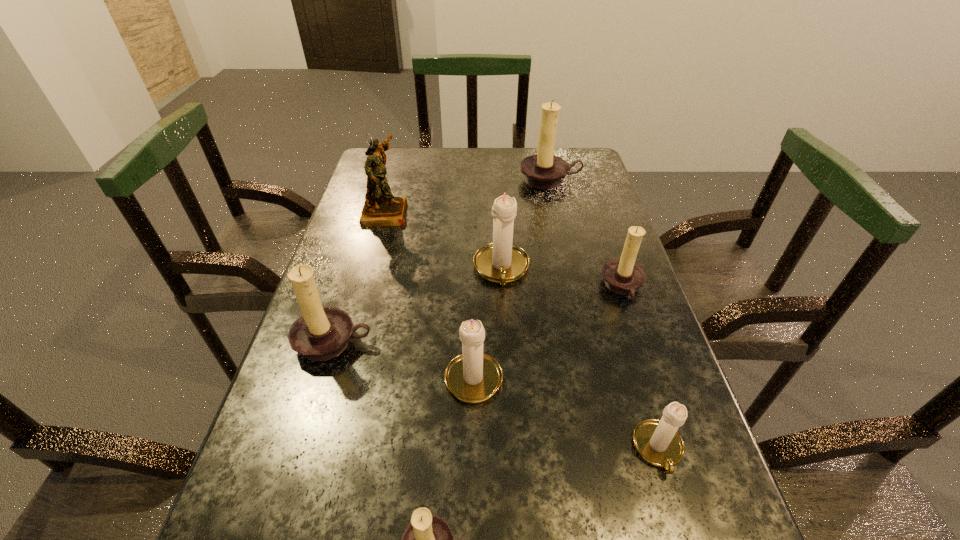
Image resolution: width=960 pixels, height=540 pixels. In order to click on the seventh farthest object in this screenshot , I will do `click(658, 442)`.

What are the coordinates of `vacant space situated 0.260m on the wick of the biggest brown candle holder` in the screenshot? It's located at (565, 247).

Where is `free region located 0.250m on the front-facing side of the second farthest object`? The width and height of the screenshot is (960, 540). free region located 0.250m on the front-facing side of the second farthest object is located at coordinates (496, 212).

The width and height of the screenshot is (960, 540). I want to click on vacant space located on the handle side of the biggest white candle holder, so click(507, 378).

I want to click on free point located 0.140m on the wick of the second nearest brown candle holder, so click(305, 435).

At what (x,y) coordinates should I click in order to perform the action: click on free space located 0.160m on the wick of the second farthest brown candle holder. Please return your answer as a coordinate pair (x, y). The image size is (960, 540). Looking at the image, I should click on (533, 288).

Identify the location of vacant space located 0.160m on the wick of the second farthest brown candle holder. The height and width of the screenshot is (540, 960). (533, 288).

Identify the location of free location located on the wick of the second farthest brown candle holder. The height and width of the screenshot is (540, 960). (464, 288).

At what (x,y) coordinates should I click in order to perform the action: click on free space located on the handle side of the second biggest white candle holder. Please return your answer as a coordinate pair (x, y). The width and height of the screenshot is (960, 540). Looking at the image, I should click on (475, 280).

You are a GUI agent. You are given a task and a screenshot of the screen. Output one action in this format:
    pyautogui.click(x=<x>, y=<y>)
    Task: Click on the free spot located on the handle side of the second biggest white candle holder
    
    Given the screenshot: What is the action you would take?
    tap(475, 236)